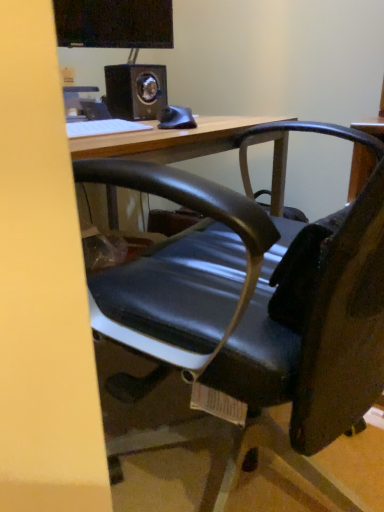
Where is `white matte keyboard at upper left`? This screenshot has width=384, height=512. white matte keyboard at upper left is located at coordinates (103, 127).

Where is `metallic black speaker at upper center`? metallic black speaker at upper center is located at coordinates (136, 91).

You are a GUI agent. You are given a task and a screenshot of the screen. Output one action in this format:
    pyautogui.click(x=<x>, y=<y>)
    Task: Click on the wooden desk at center
    This screenshot has width=384, height=512.
    Given the screenshot: What is the action you would take?
    pos(252,296)

Can you confirm if wooden desk at center is wider than black glossy monitor at upper center?

Yes, wooden desk at center is wider than black glossy monitor at upper center.

From the image's perspective, is wooden desk at center on top of black glossy monitor at upper center?

Actually, wooden desk at center appears below black glossy monitor at upper center in the image.

In the image, is wooden desk at center positioned in front of or behind black glossy monitor at upper center?

Clearly, wooden desk at center is in front of black glossy monitor at upper center.

Between point (232, 193) and point (112, 38), which one is positioned behind?

Positioned behind is point (232, 193).

Is black glossy monitor at upper center facing towards wooden desk at center?

No, black glossy monitor at upper center is not aimed at wooden desk at center.

Is black glossy monitor at upper center bigger than wooden desk at center?

No.

Between black glossy monitor at upper center and wooden desk at center, which one appears on the left side from the viewer's perspective?

black glossy monitor at upper center is more to the left.

From a real-world perspective, is black glossy monitor at upper center above or below wooden desk at center?

In terms of real-world spatial position, black glossy monitor at upper center is above wooden desk at center.

Are metallic black speaker at upper center and wooden desk at center far apart?

No, there isn't a large distance between metallic black speaker at upper center and wooden desk at center.

Is wooden desk at center inside metallic black speaker at upper center?

Actually, wooden desk at center is outside metallic black speaker at upper center.

Based on the photo, is metallic black speaker at upper center oriented towards wooden desk at center?

Yes, metallic black speaker at upper center is turned towards wooden desk at center.

Considering the positions of objects black glossy monitor at upper center and white matte keyboard at upper left in the image provided, who is more to the left, black glossy monitor at upper center or white matte keyboard at upper left?

From the viewer's perspective, black glossy monitor at upper center appears more on the left side.

Is black glossy monitor at upper center facing towards white matte keyboard at upper left?

No, black glossy monitor at upper center does not turn towards white matte keyboard at upper left.

From a real-world perspective, which is physically above, black glossy monitor at upper center or white matte keyboard at upper left?

black glossy monitor at upper center.

Is black glossy monitor at upper center outside of white matte keyboard at upper left?

That's correct, black glossy monitor at upper center is outside of white matte keyboard at upper left.

I want to click on keyboard above the wooden desk at center (from the image's perspective), so click(103, 127).

Does white matte keyboard at upper left have a smaller size compared to wooden desk at center?

Yes.

Which of these two, white matte keyboard at upper left or wooden desk at center, is thinner?

white matte keyboard at upper left is thinner.

Considering the relative positions of wooden desk at center and metallic black speaker at upper center in the image provided, is wooden desk at center in front of metallic black speaker at upper center?

Yes, the depth of wooden desk at center is less than that of metallic black speaker at upper center.

Does wooden desk at center have a larger size compared to metallic black speaker at upper center?

Correct, wooden desk at center is larger in size than metallic black speaker at upper center.

How different are the orientations of wooden desk at center and metallic black speaker at upper center in degrees?

170 degrees.

Is point (95, 302) in front of point (99, 120)?

Yes, point (95, 302) is in front of point (99, 120).

Who is shorter, wooden desk at center or white matte keyboard at upper left?

With less height is white matte keyboard at upper left.

How distant is wooden desk at center from white matte keyboard at upper left?

wooden desk at center and white matte keyboard at upper left are 14.64 inches apart.

Can you tell me how much wooden desk at center and white matte keyboard at upper left differ in facing direction?

They differ by 178 degrees in their facing directions.

Locate an element on the screen. This screenshot has width=384, height=512. table in front of the black glossy monitor at upper center is located at coordinates (252, 296).

Find the location of a particular element. This screenshot has width=384, height=512. table that appears on the right of black glossy monitor at upper center is located at coordinates (252, 296).

Which object lies further to the anchor point metallic black speaker at upper center, white matte keyboard at upper left or black glossy monitor at upper center?

Based on the image, white matte keyboard at upper left appears to be further to metallic black speaker at upper center.

Considering their positions, is white matte keyboard at upper left positioned further to wooden desk at center than metallic black speaker at upper center?

metallic black speaker at upper center.

Based on their spatial positions, is wooden desk at center or black glossy monitor at upper center closer to white matte keyboard at upper left?

Based on the image, wooden desk at center appears to be nearer to white matte keyboard at upper left.

From the image, which object appears to be farther from black glossy monitor at upper center, metallic black speaker at upper center or white matte keyboard at upper left?

white matte keyboard at upper left lies further to black glossy monitor at upper center than the other object.

Looking at the image, which one is located closer to black glossy monitor at upper center, white matte keyboard at upper left or wooden desk at center?

white matte keyboard at upper left is positioned closer to the anchor black glossy monitor at upper center.

Based on the photo, based on their spatial positions, is black glossy monitor at upper center or white matte keyboard at upper left further from metallic black speaker at upper center?

white matte keyboard at upper left lies further to metallic black speaker at upper center than the other object.

Considering their positions, is metallic black speaker at upper center positioned closer to wooden desk at center than black glossy monitor at upper center?

The object closer to wooden desk at center is metallic black speaker at upper center.

Looking at the image, which one is located closer to wooden desk at center, metallic black speaker at upper center or white matte keyboard at upper left?

white matte keyboard at upper left is closer to wooden desk at center.

Locate an element on the screen. Image resolution: width=384 pixels, height=512 pixels. keyboard between wooden desk at center and black glossy monitor at upper center in the front-back direction is located at coordinates (103, 127).

Find the location of a particular element. The width and height of the screenshot is (384, 512). speaker between white matte keyboard at upper left and black glossy monitor at upper center from front to back is located at coordinates (136, 91).

The width and height of the screenshot is (384, 512). In order to click on speaker between wooden desk at center and black glossy monitor at upper center in the front-back direction in this screenshot , I will do `click(136, 91)`.

Where is `keyboard between wooden desk at center and metallic black speaker at upper center from front to back`? Image resolution: width=384 pixels, height=512 pixels. keyboard between wooden desk at center and metallic black speaker at upper center from front to back is located at coordinates coord(103,127).